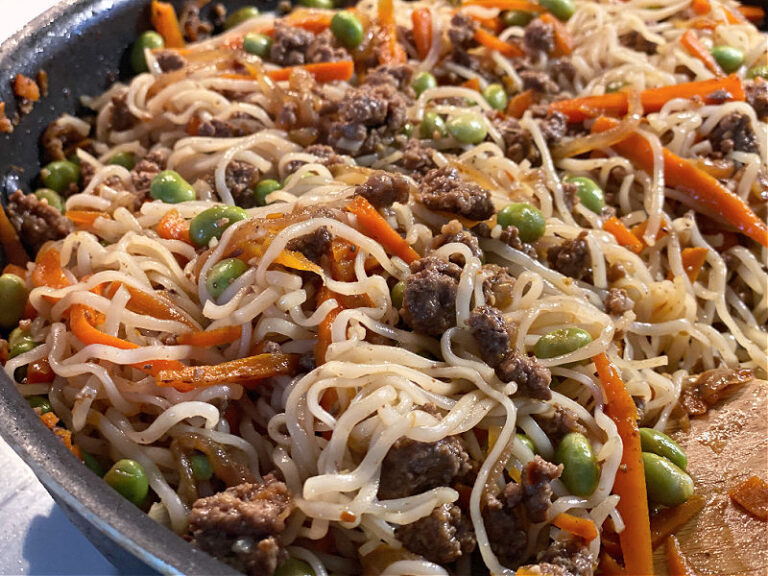
Where is `table`? table is located at coordinates pyautogui.click(x=28, y=539).